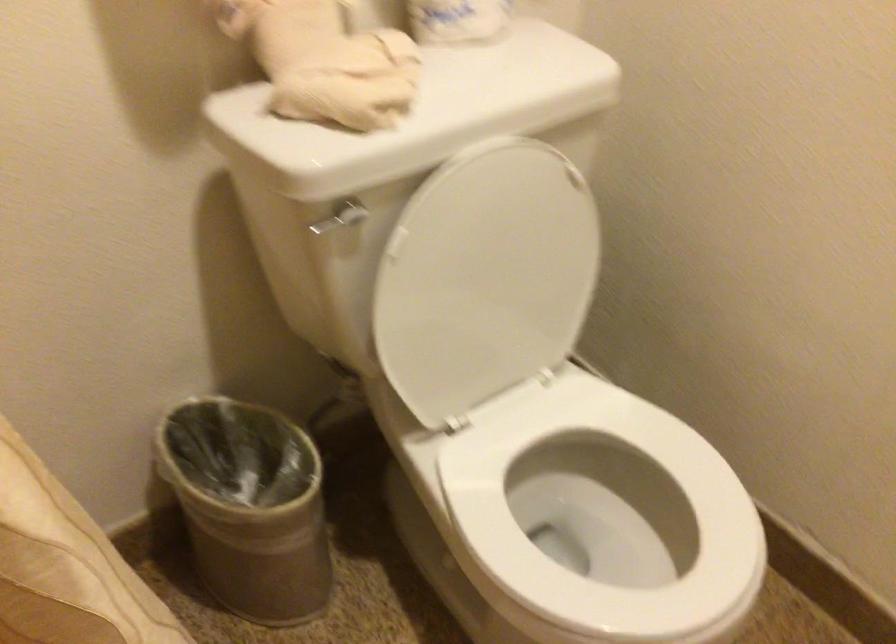
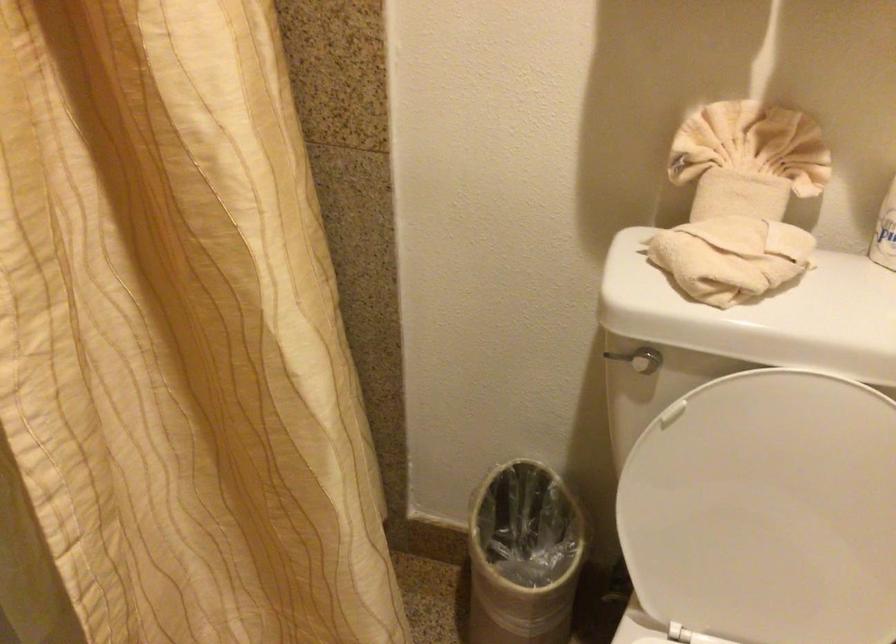
The point at (239, 491) is marked in the first image. Where is the corresponding point in the second image?

(522, 556)